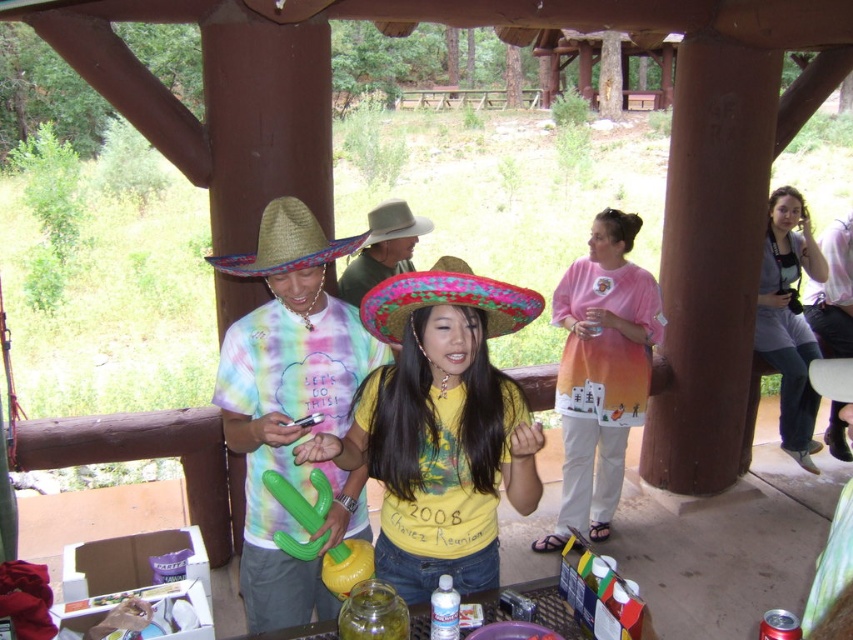
Is strawhat at center shorter than white felt cowboy hat at center?

Correct, strawhat at center is not as tall as white felt cowboy hat at center.

Between strawhat at center and white felt cowboy hat at center, which one is positioned higher?

white felt cowboy hat at center

Identify the location of strawhat at center. The width and height of the screenshot is (853, 640). (286, 243).

Which is above, strawhat at center or rustic straw hat at center?

strawhat at center

Image resolution: width=853 pixels, height=640 pixels. Describe the element at coordinates (286, 243) in the screenshot. I see `strawhat at center` at that location.

The image size is (853, 640). In order to click on strawhat at center in this screenshot , I will do `click(286, 243)`.

This screenshot has width=853, height=640. Find the location of `strawhat at center`. strawhat at center is located at coordinates (286, 243).

Between yellow matte shirt at center and yellow t-shirt at center, which one is positioned higher?

yellow matte shirt at center

Who is positioned more to the right, yellow matte shirt at center or yellow t-shirt at center?

yellow matte shirt at center

Is point (387, 552) closer to viewer compared to point (256, 259)?

No.

Identify the location of yellow matte shirt at center. The height and width of the screenshot is (640, 853). (440, 426).